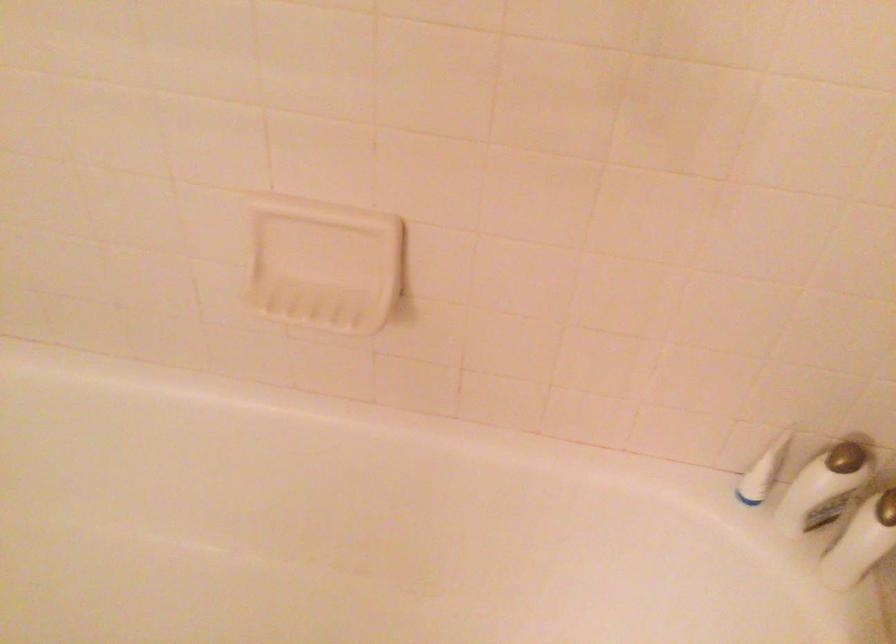
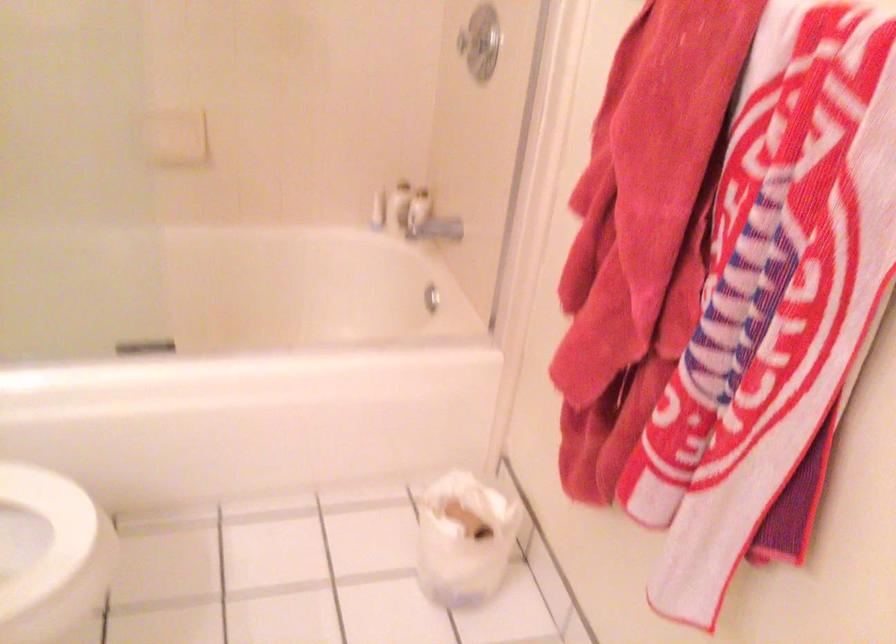
The point at (x=807, y=498) is marked in the first image. Where is the corresponding point in the second image?

(399, 205)